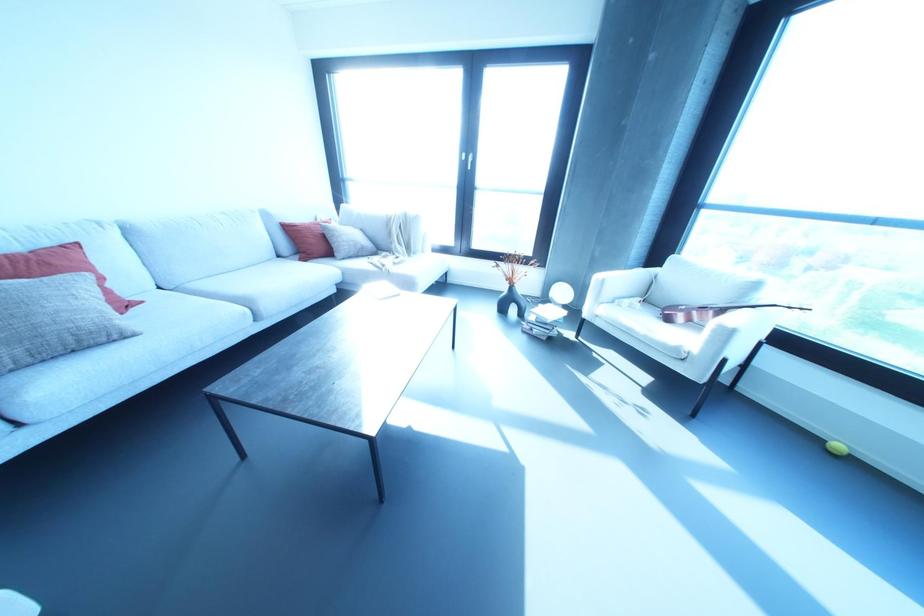
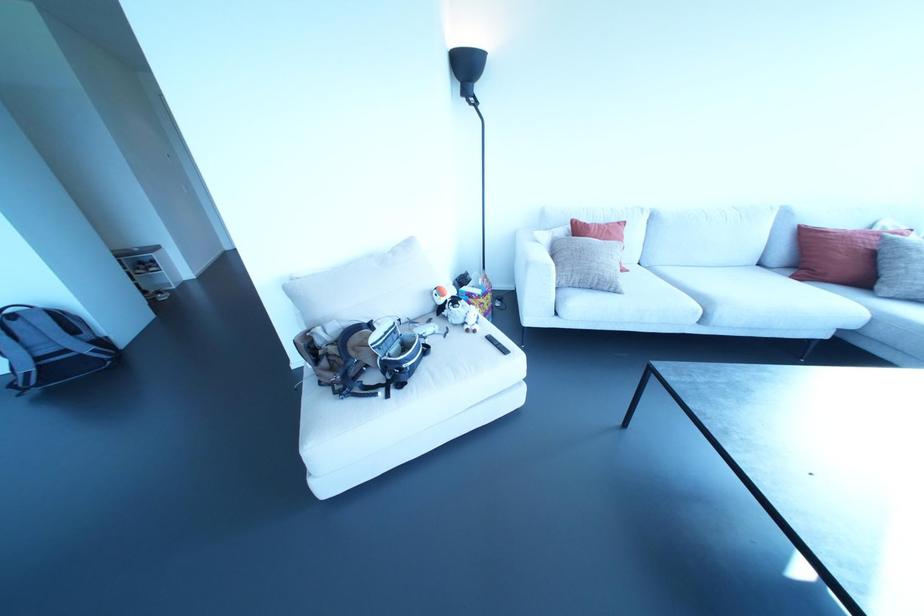
In the second image, find the point that corresponds to (322,236) in the first image.

(872, 254)